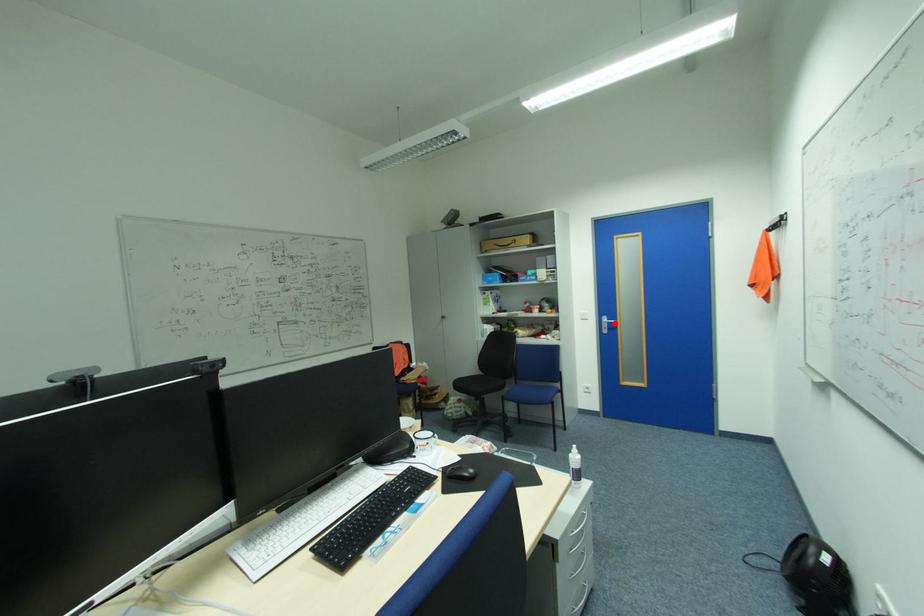
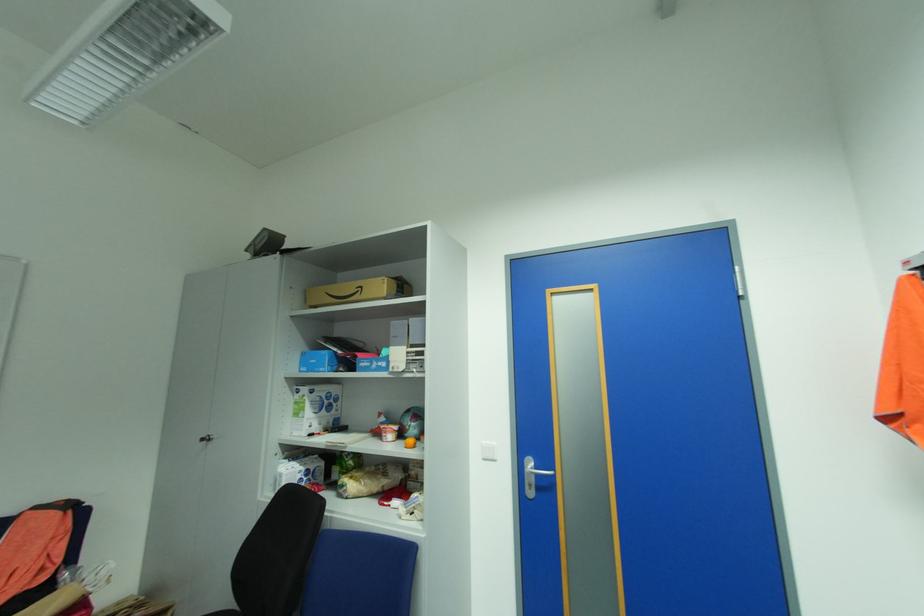
Question: I am providing you with two images of the same scene from different viewpoints. A red point is marked on the first image. At the location where the point appears in image 1, is it still visible in image 2?

Choices:
 (A) Yes
 (B) No

Answer: (A)